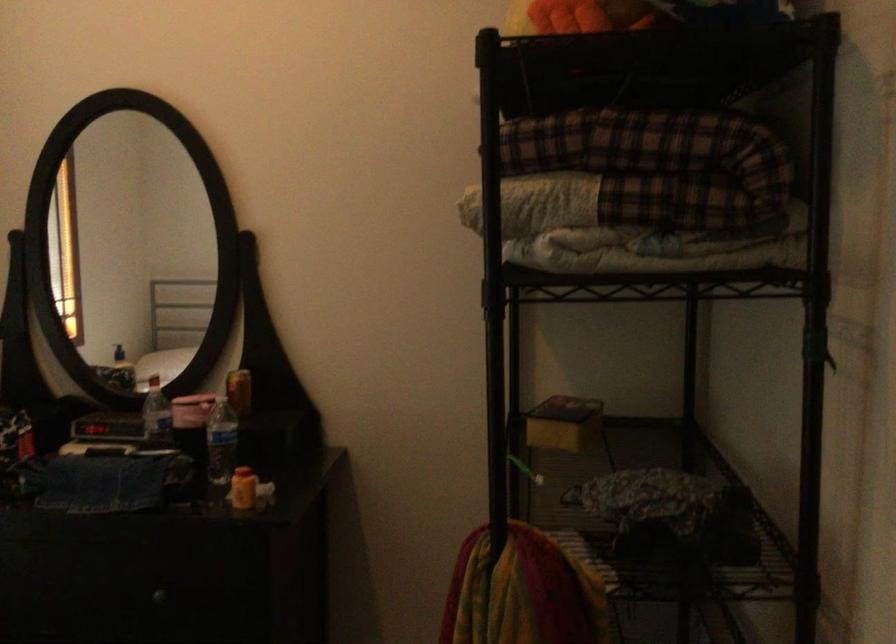
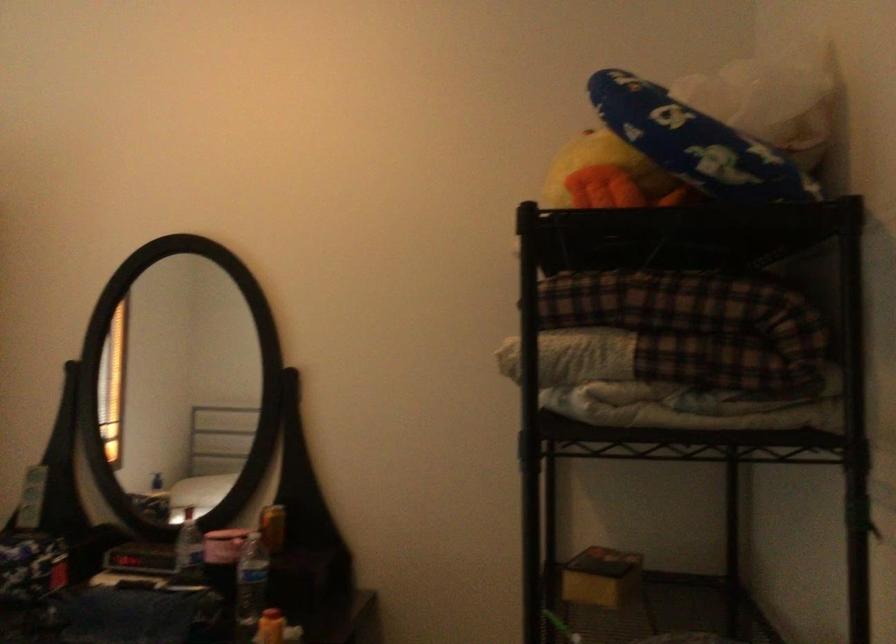
In the second image, find the point that corresponds to (x=564, y=422) in the first image.

(600, 576)